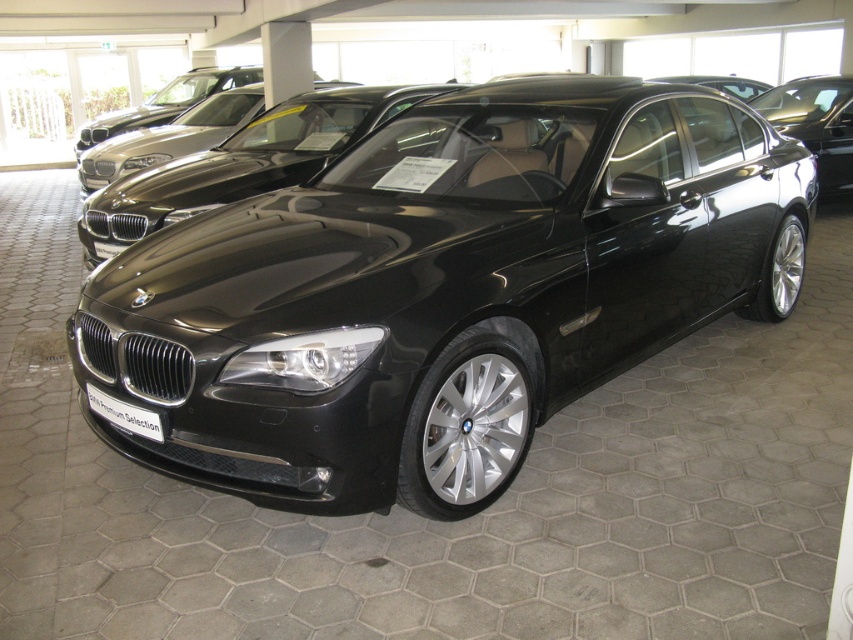
Does point (477, 291) lie behind point (108, 396)?

No, it is in front of (108, 396).

Who is more forward, (274, 193) or (144, 416)?

Point (144, 416)

Identify the location of shiny black car at center. Image resolution: width=853 pixels, height=640 pixels. (442, 291).

Is point (494, 467) closer to viewer compared to point (218, 84)?

Yes, point (494, 467) is in front of point (218, 84).

Who is more forward, (532, 113) or (85, 141)?

Point (532, 113) is more forward.

Is point (509, 136) positioned in front of point (117, 120)?

Yes.

This screenshot has height=640, width=853. Identify the location of shiny black car at center. (442, 291).

Is point (170, 81) closer to camera compared to point (111, 419)?

No, (170, 81) is further to viewer.

Consider the image. Which is more to the right, satin black sedan at center or black metallic license plate at center?

black metallic license plate at center

Is point (194, 84) behind point (91, 392)?

Yes.

Image resolution: width=853 pixels, height=640 pixels. I want to click on satin black sedan at center, so click(x=166, y=100).